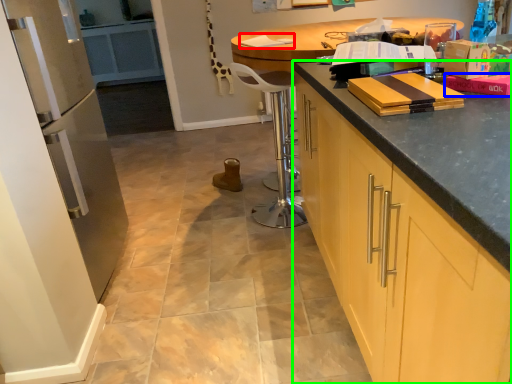
Question: Which is nearer to the book (highlighted by a red box)? book (highlighted by a blue box) or cabinetry (highlighted by a green box).

Choices:
 (A) book
 (B) cabinetry

Answer: (A)